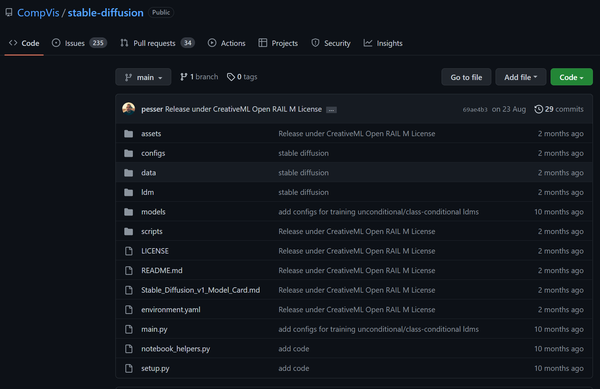
Locate an element on the screen. The image size is (600, 389). folders is located at coordinates (162, 132), (160, 156), (163, 180), (164, 196), (180, 215), (181, 231).